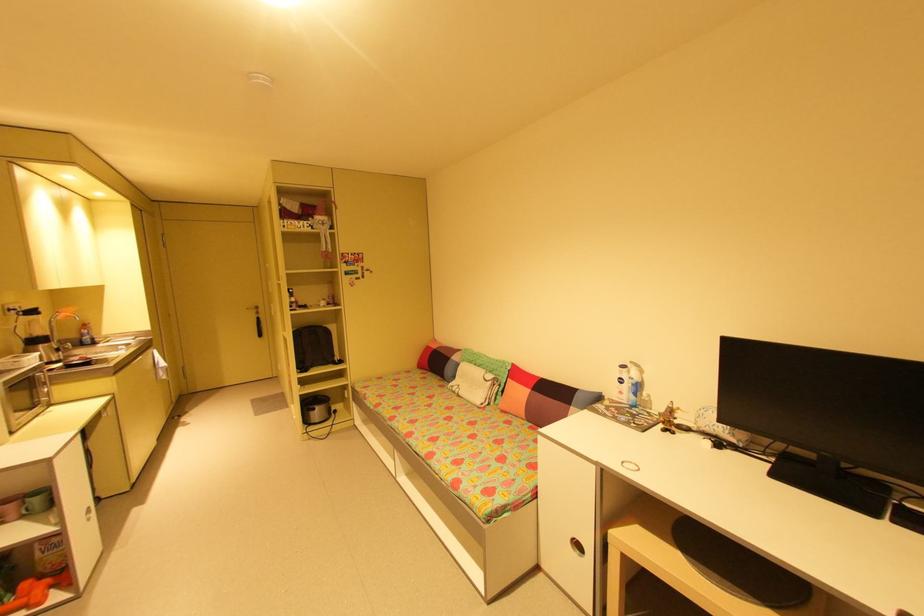
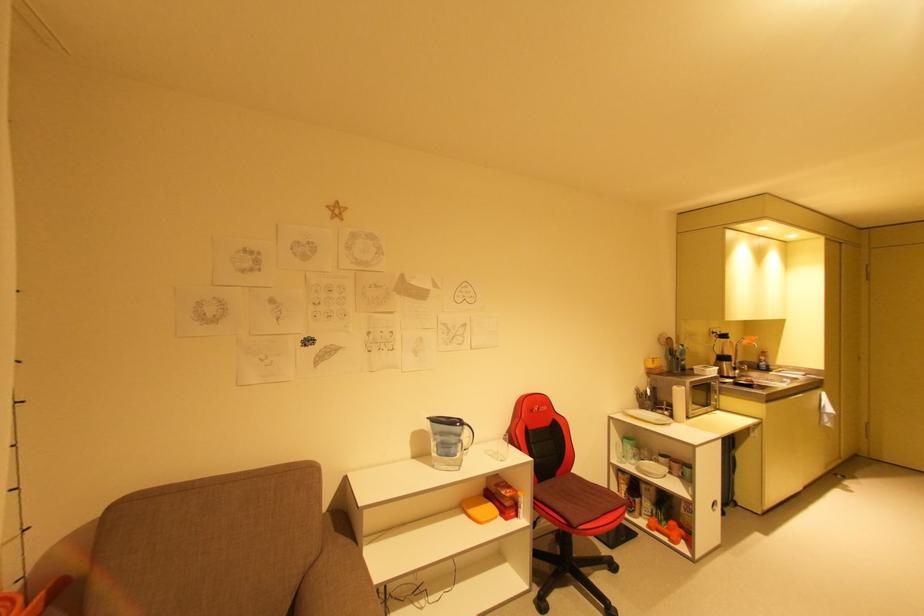
In the second image, find the point that corresponds to (31,406) in the first image.

(708, 403)